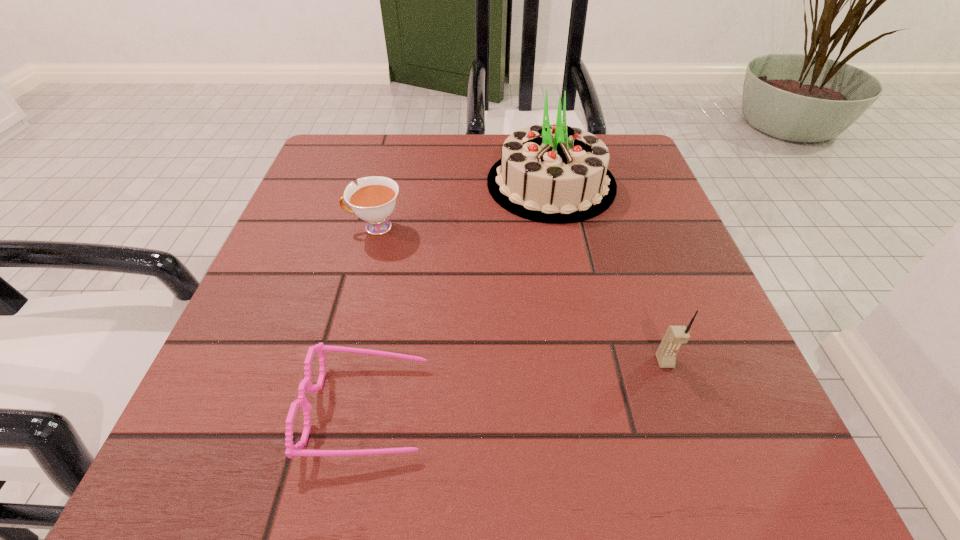
The image size is (960, 540). I want to click on free region at the far right corner, so click(x=652, y=176).

The image size is (960, 540). I want to click on vacant space at the near right corner, so click(679, 461).

Locate an element on the screen. unoccupied position between the shortest object and the teacup is located at coordinates (372, 318).

Locate an element on the screen. The image size is (960, 540). vacant area between the tallest object and the third shortest object is located at coordinates (608, 273).

Locate an element on the screen. free space between the shortest object and the cellular telephone is located at coordinates (516, 384).

Where is `vacant area between the birthday cake and the teacup`? The width and height of the screenshot is (960, 540). vacant area between the birthday cake and the teacup is located at coordinates (463, 205).

The height and width of the screenshot is (540, 960). What are the coordinates of `vacant point located between the tallest object and the shortest object` in the screenshot? It's located at (460, 296).

The image size is (960, 540). In order to click on free space between the third tallest object and the spectacles in this screenshot , I will do `click(372, 318)`.

Find the location of a particular element. This screenshot has height=540, width=960. vacant area that lies between the spectacles and the second shortest object is located at coordinates (372, 318).

You are a GUI agent. You are given a task and a screenshot of the screen. Output one action in this format:
    pyautogui.click(x=<x>, y=<y>)
    Task: Click on the free point between the cellular telephone and the tallest object
    This screenshot has height=540, width=960.
    Given the screenshot: What is the action you would take?
    pyautogui.click(x=608, y=273)